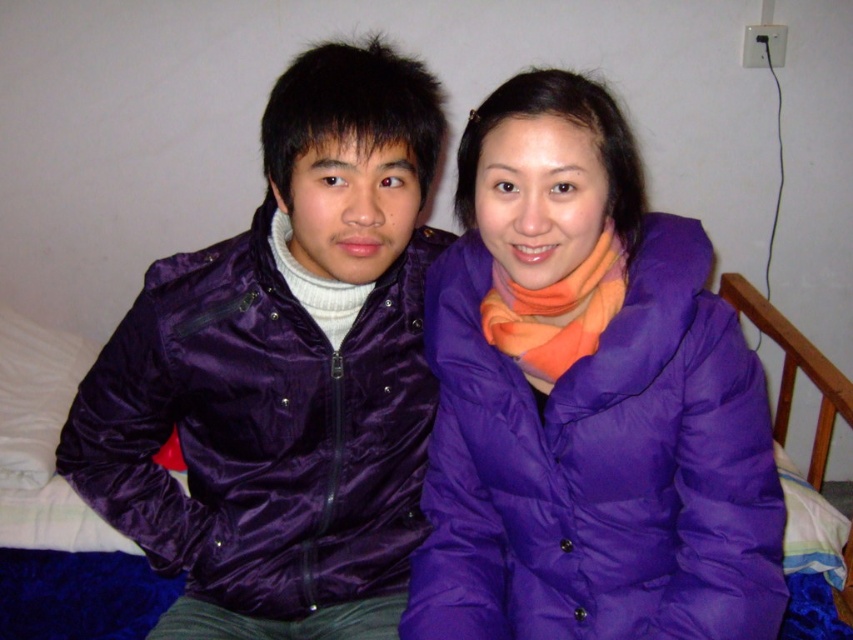
Who is more forward, (648, 573) or (265, 323)?

Point (648, 573) is in front.

Does point (641, 545) come farther from viewer compared to point (91, 435)?

No, (641, 545) is closer to viewer.

Locate an element on the screen. The height and width of the screenshot is (640, 853). purple down jacket at right is located at coordinates (589, 404).